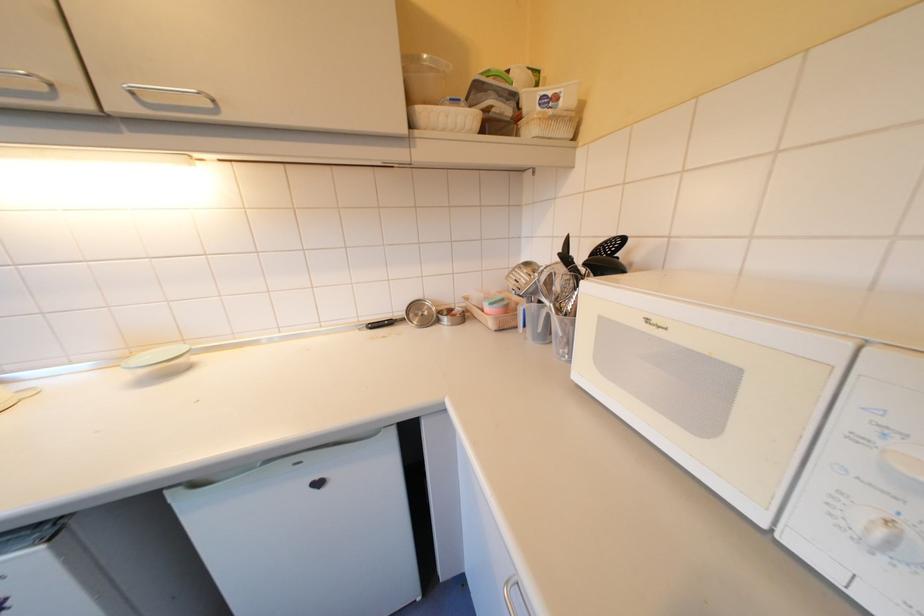
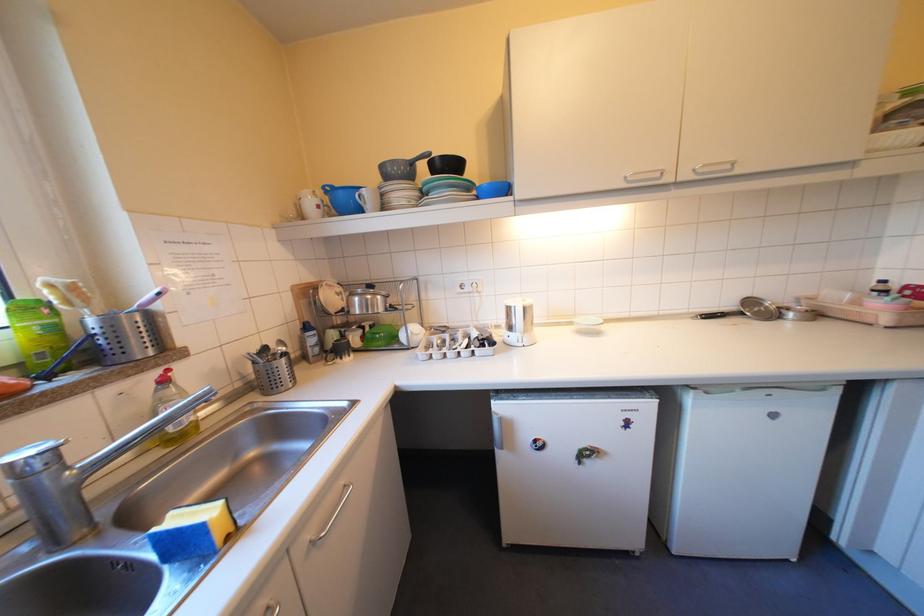
Find the pixel in the second image that matches (157,98) in the first image.

(712, 169)